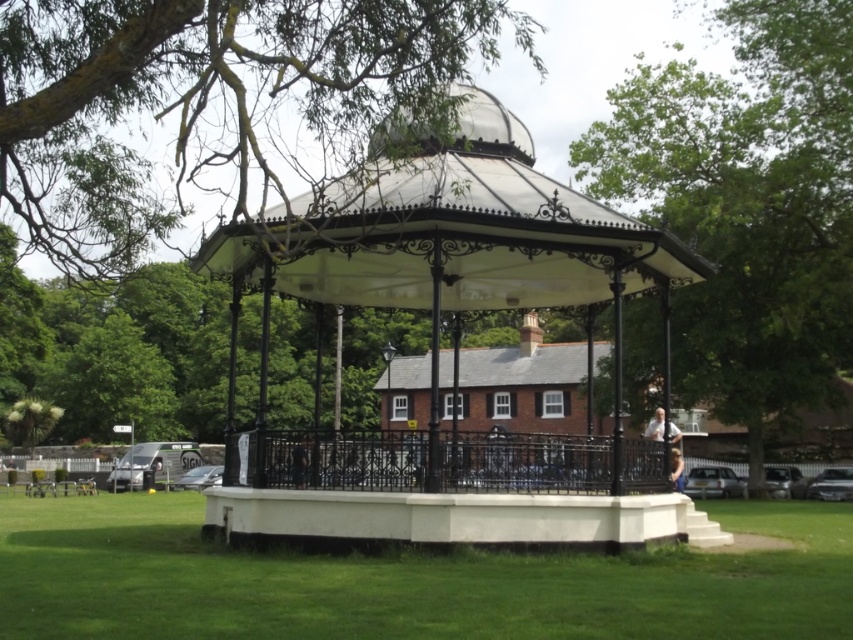
Does green leafy tree at upper left appear over white stone gazebo at center?

Correct, green leafy tree at upper left is located above white stone gazebo at center.

Which is more to the right, green leafy tree at upper left or white stone gazebo at center?

Positioned to the right is white stone gazebo at center.

Who is more distant from viewer, (x=392, y=12) or (x=527, y=566)?

Point (x=527, y=566)

Identify the location of green leafy tree at upper left. This screenshot has width=853, height=640. [213, 104].

You are a GUI agent. You are given a task and a screenshot of the screen. Output one action in this format:
    pyautogui.click(x=<x>, y=<y>)
    Task: Click on the green leafy tree at upper left
    Image resolution: width=853 pixels, height=640 pixels.
    Given the screenshot: What is the action you would take?
    pyautogui.click(x=213, y=104)

Who is more distant from viewer, [286,136] or [595,173]?

The point [595,173] is behind.

Identify the location of green leafy tree at upper left. The width and height of the screenshot is (853, 640). (213, 104).

Between green leafy tree at upper left and black wrought iron gazebo at center, which one appears on the right side from the viewer's perspective?

black wrought iron gazebo at center is more to the right.

Is green leafy tree at upper left bigger than black wrought iron gazebo at center?

Indeed, green leafy tree at upper left has a larger size compared to black wrought iron gazebo at center.

Is point (447, 58) farther from viewer compared to point (416, 282)?

No, it is in front of (416, 282).

This screenshot has height=640, width=853. I want to click on green leafy tree at upper left, so click(x=213, y=104).